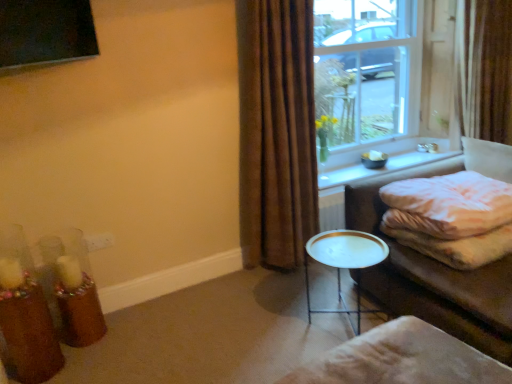
Question: Can you confirm if beige fabric footrest at lower right is thinner than white textured blanket at right?

Choices:
 (A) no
 (B) yes

Answer: (A)

Question: From the image's perspective, is beige fabric footrest at lower right over white textured blanket at right?

Choices:
 (A) no
 (B) yes

Answer: (A)

Question: Is beige fabric footrest at lower right turned away from white textured blanket at right?

Choices:
 (A) no
 (B) yes

Answer: (B)

Question: Can you see beige fabric footrest at lower right touching white textured blanket at right?

Choices:
 (A) no
 (B) yes

Answer: (A)

Question: Is beige fabric footrest at lower right far away from white textured blanket at right?

Choices:
 (A) no
 (B) yes

Answer: (A)

Question: Does beige fabric footrest at lower right lie behind white textured blanket at right?

Choices:
 (A) yes
 (B) no

Answer: (B)

Question: Considering the relative sizes of translucent glass candle holder at lower left, the first candle holder in the back-to-front sequence, and white textured blanket at right in the image provided, is translucent glass candle holder at lower left, the first candle holder in the back-to-front sequence, thinner than white textured blanket at right?

Choices:
 (A) yes
 (B) no

Answer: (A)

Question: Is translucent glass candle holder at lower left, the first candle holder in the back-to-front sequence, smaller than white textured blanket at right?

Choices:
 (A) yes
 (B) no

Answer: (A)

Question: Considering the relative positions of translucent glass candle holder at lower left, the first candle holder in the back-to-front sequence, and white textured blanket at right in the image provided, is translucent glass candle holder at lower left, the first candle holder in the back-to-front sequence, behind white textured blanket at right?

Choices:
 (A) no
 (B) yes

Answer: (B)

Question: Is translucent glass candle holder at lower left, the first candle holder in the back-to-front sequence, directly adjacent to white textured blanket at right?

Choices:
 (A) no
 (B) yes

Answer: (A)

Question: Can you confirm if translucent glass candle holder at lower left, arranged as the second candle holder when viewed from the front, is shorter than white textured blanket at right?

Choices:
 (A) no
 (B) yes

Answer: (A)

Question: Is there a large distance between translucent glass candle holder at lower left, the first candle holder in the back-to-front sequence, and white textured blanket at right?

Choices:
 (A) yes
 (B) no

Answer: (A)

Question: Considering the relative sizes of clear glass window at upper right and brown fabric curtain at right, the 2th curtain viewed from the left, in the image provided, is clear glass window at upper right thinner than brown fabric curtain at right, the 2th curtain viewed from the left,?

Choices:
 (A) no
 (B) yes

Answer: (B)